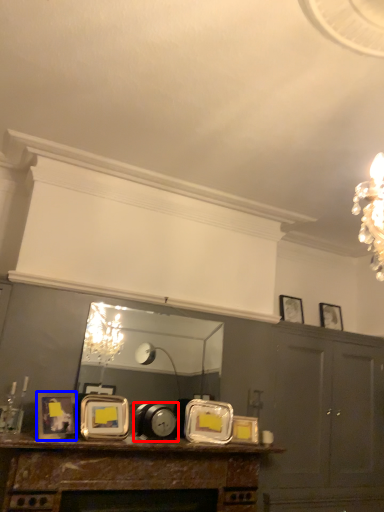
Question: Which object appears farthest to the camera in this image, alarm clock (highlighted by a red box) or picture frame (highlighted by a blue box)?

Choices:
 (A) alarm clock
 (B) picture frame

Answer: (A)